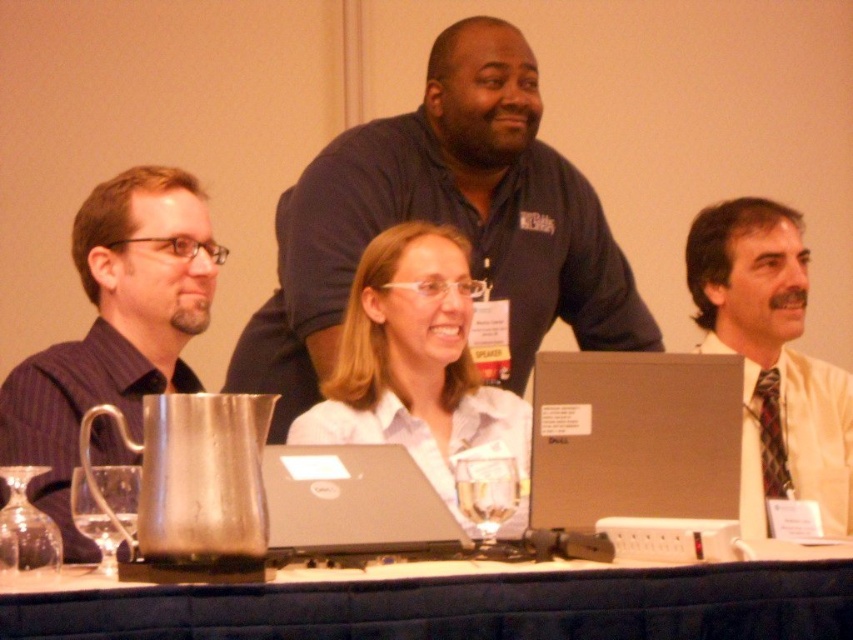
You are attending a formal meeting and need to place a document on the table between the silver metallic laptop at center and the white shirt at center. Can you fit the document there without it overlapping either object?

The silver metallic laptop at center is not as tall as the white shirt at center, so there is space between them. You can place the document there without overlapping either object.

You are a photographer adjusting your camera to capture the scene. You notice two points marked in the image. Which point, point (735, 476) or point (838, 449), is closer to your camera lens?

Point (735, 476) is closer to the viewer than point (838, 449), so it is closer to the camera lens.

You are a photographer positioned in front of the table where the meeting is taking place. You want to capture a closeup shot of the dark blue shirt at center without moving any of the participants. Considering your current position, is it possible to do so without needing to move closer than 2 meters?

The distance between the dark blue shirt at center and the viewer is 2.33 meters, so yes, you can capture a closeup shot without moving closer than 2 meters since the required distance is slightly more than 2 meters.